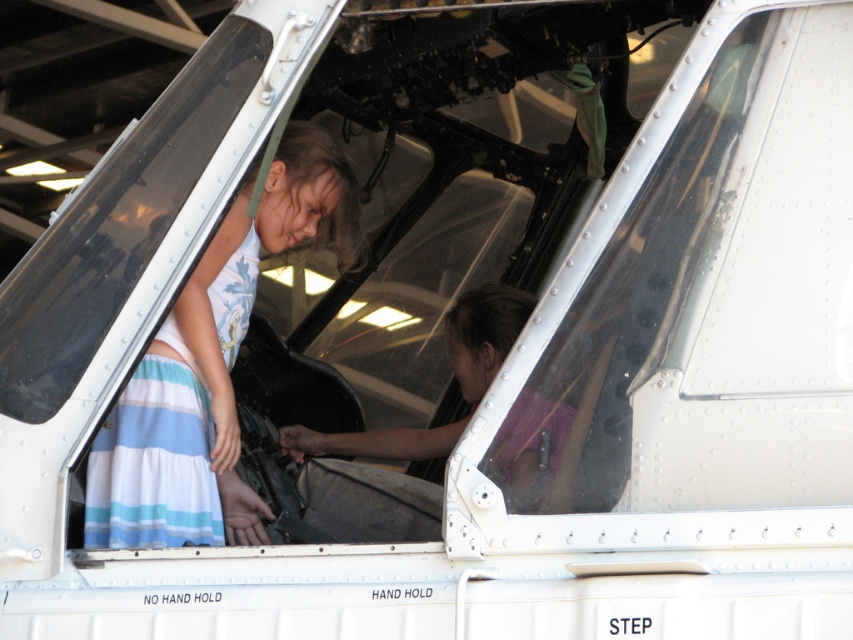
Which is more to the left, striped cotton dress at center or pink matte shirt at center?

Positioned to the left is striped cotton dress at center.

Who is taller, striped cotton dress at center or pink matte shirt at center?

striped cotton dress at center

The height and width of the screenshot is (640, 853). In order to click on striped cotton dress at center in this screenshot , I will do `click(212, 368)`.

Is striped cotton dress at center further to the viewer compared to striped cotton dress at lower left?

No, striped cotton dress at center is in front of striped cotton dress at lower left.

Which of these two, striped cotton dress at center or striped cotton dress at lower left, stands taller?

striped cotton dress at center

Describe the element at coordinates (212, 368) in the screenshot. This screenshot has width=853, height=640. I see `striped cotton dress at center` at that location.

You are a GUI agent. You are given a task and a screenshot of the screen. Output one action in this format:
    pyautogui.click(x=<x>, y=<y>)
    Task: Click on the striped cotton dress at center
    This screenshot has width=853, height=640.
    Given the screenshot: What is the action you would take?
    pyautogui.click(x=212, y=368)

Who is shorter, striped cotton dress at lower left or pink matte shirt at center?

pink matte shirt at center

Describe the element at coordinates (155, 458) in the screenshot. I see `striped cotton dress at lower left` at that location.

I want to click on striped cotton dress at lower left, so click(155, 458).